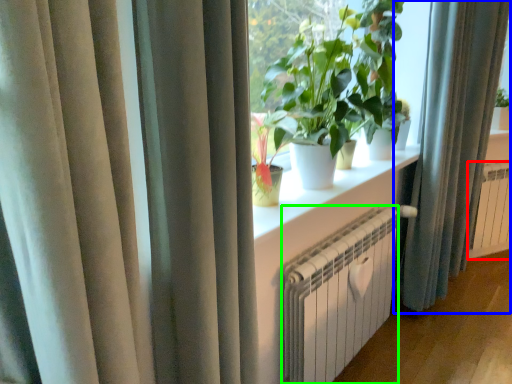
Question: Based on their relative distances, which object is farther from radiator (highlighted by a red box)? Choose from curtain (highlighted by a blue box) and heater (highlighted by a green box).

Choices:
 (A) curtain
 (B) heater

Answer: (B)